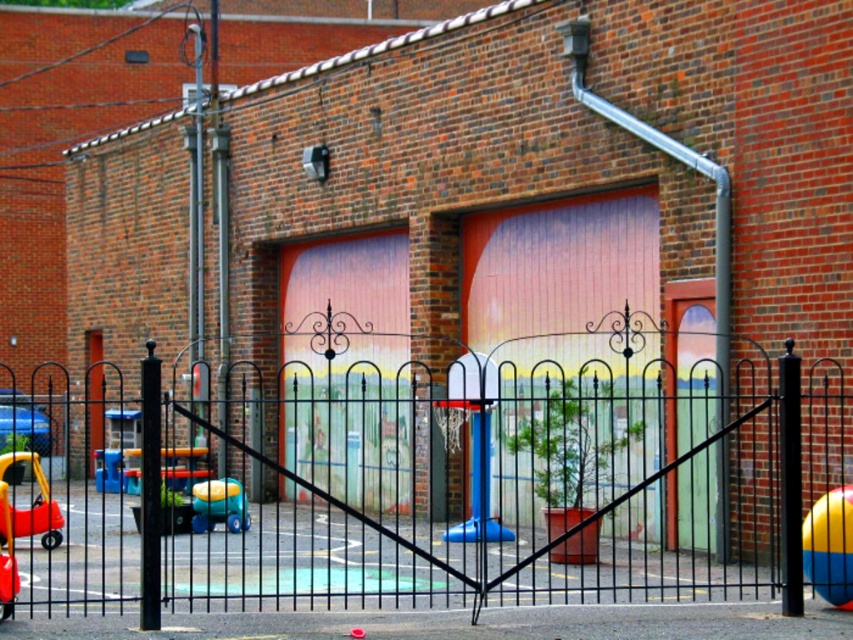
Question: Is yellow rubber beach ball at right to the left of matte plastic toy car at lower left from the viewer's perspective?

Choices:
 (A) no
 (B) yes

Answer: (A)

Question: Which of the following is the closest to the observer?

Choices:
 (A) pink painted wood garage door at center
 (B) black wrought iron gate at center

Answer: (B)

Question: Which object appears closest to the camera in this image?

Choices:
 (A) matte yellow plastic car at lower left
 (B) yellow rubber toy car at left

Answer: (A)

Question: Does pink painted wood garage door at center come behind yellow rubber beach ball at right?

Choices:
 (A) no
 (B) yes

Answer: (B)

Question: Does matte pink wooden garage door at center come behind matte yellow toy car at lower left?

Choices:
 (A) yes
 (B) no

Answer: (A)

Question: Estimate the real-world distances between objects in this image. Which object is farther from the black wrought iron gate at center?

Choices:
 (A) matte plastic toy car at lower left
 (B) pink painted wood garage door at center
 (C) yellow rubber beach ball at right

Answer: (C)